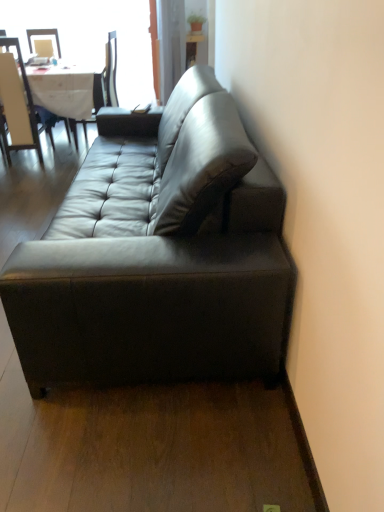
Image resolution: width=384 pixels, height=512 pixels. What do you see at coordinates (92, 37) in the screenshot?
I see `transparent glass window at upper left` at bounding box center [92, 37].

Describe the element at coordinates (102, 87) in the screenshot. I see `matte black chair at upper left, the first chair viewed from the right` at that location.

The width and height of the screenshot is (384, 512). What do you see at coordinates (68, 92) in the screenshot?
I see `white cloth table at upper left` at bounding box center [68, 92].

In order to face white cloth table at upper left, should I rotate leftwards or rightwards?

To face it directly, rotate left by 18.869 degrees.

Locate an element on the screen. transparent glass window at upper left is located at coordinates (92, 37).

You are a GUI agent. You are given a task and a screenshot of the screen. Output one action in this format:
    pyautogui.click(x=<x>, y=<y>)
    Task: Click on the 2nd chair in front of the transparent glass window at upper left, starting your count from the anchor
    The height and width of the screenshot is (512, 384).
    Given the screenshot: What is the action you would take?
    pyautogui.click(x=21, y=105)

From a real-world perspective, which is physically above, transparent glass window at upper left or light beige wood chair at upper left, the first chair viewed from the left?

From a 3D spatial view, transparent glass window at upper left is above.

Is transparent glass window at upper left far from light beige wood chair at upper left, which is the second chair from right to left?

They are positioned close to each other.

From the image's perspective, which one is positioned lower, transparent glass window at upper left or light beige wood chair at upper left, which is the second chair from right to left?

From the image's view, light beige wood chair at upper left, which is the second chair from right to left, is below.

Looking at their sizes, would you say transparent glass window at upper left is wider or thinner than matte black couch at center?

In the image, transparent glass window at upper left appears to be more narrow than matte black couch at center.

In terms of size, does transparent glass window at upper left appear bigger or smaller than matte black couch at center?

Considering their sizes, transparent glass window at upper left takes up less space than matte black couch at center.

Can you confirm if transparent glass window at upper left is shorter than matte black couch at center?

In fact, transparent glass window at upper left may be taller than matte black couch at center.

Considering the sizes of light beige wood chair at upper left, which is the second chair from right to left, and transparent glass window at upper left in the image, is light beige wood chair at upper left, which is the second chair from right to left, wider or thinner than transparent glass window at upper left?

In the image, light beige wood chair at upper left, which is the second chair from right to left, appears to be wider than transparent glass window at upper left.

Looking at this image, considering the sizes of light beige wood chair at upper left, which is the second chair from right to left, and transparent glass window at upper left in the image, is light beige wood chair at upper left, which is the second chair from right to left, taller or shorter than transparent glass window at upper left?

light beige wood chair at upper left, which is the second chair from right to left, is shorter than transparent glass window at upper left.

From a real-world perspective, is light beige wood chair at upper left, the first chair viewed from the left, over transparent glass window at upper left?

No, from a real-world perspective, light beige wood chair at upper left, the first chair viewed from the left, is not above transparent glass window at upper left.

Does light beige wood chair at upper left, the first chair viewed from the left, come behind transparent glass window at upper left?

No, it is not.

From the transparent glass window at upper left, count 1st chairs forward and point to it. Please provide its 2D coordinates.

[(102, 87)]

Which object is more forward, matte black chair at upper left, the second chair in the left-to-right sequence, or transparent glass window at upper left?

matte black chair at upper left, the second chair in the left-to-right sequence, is in front.

Between matte black chair at upper left, the first chair viewed from the right, and transparent glass window at upper left, which one has smaller width?

transparent glass window at upper left is thinner.

From a real-world perspective, is matte black couch at center located higher than transparent glass window at upper left?

Actually, matte black couch at center is physically below transparent glass window at upper left in the real world.

Who is more distant, matte black couch at center or transparent glass window at upper left?

transparent glass window at upper left.

Find the location of a particular element. studio couch directly beneath the transparent glass window at upper left (from a real-world perspective) is located at coordinates (159, 258).

From the image's perspective, is matte black chair at upper left, the first chair viewed from the right, above or below white cloth table at upper left?

From the image's perspective, matte black chair at upper left, the first chair viewed from the right, appears above white cloth table at upper left.

Is matte black chair at upper left, the second chair in the left-to-right sequence, looking in the opposite direction of white cloth table at upper left?

Correct, matte black chair at upper left, the second chair in the left-to-right sequence, is looking away from white cloth table at upper left.

Considering the relative sizes of matte black chair at upper left, the second chair in the left-to-right sequence, and white cloth table at upper left in the image provided, is matte black chair at upper left, the second chair in the left-to-right sequence, smaller than white cloth table at upper left?

Correct, matte black chair at upper left, the second chair in the left-to-right sequence, occupies less space than white cloth table at upper left.

From the image's perspective, does light beige wood chair at upper left, which is the second chair from right to left, appear lower than white cloth table at upper left?

Indeed, from the image's perspective, light beige wood chair at upper left, which is the second chair from right to left, is shown beneath white cloth table at upper left.

Is light beige wood chair at upper left, the first chair viewed from the left, closer to the viewer compared to white cloth table at upper left?

Yes, light beige wood chair at upper left, the first chair viewed from the left, is closer to the camera.

Considering the relative sizes of light beige wood chair at upper left, which is the second chair from right to left, and white cloth table at upper left in the image provided, is light beige wood chair at upper left, which is the second chair from right to left, shorter than white cloth table at upper left?

In fact, light beige wood chair at upper left, which is the second chair from right to left, may be taller than white cloth table at upper left.

Is light beige wood chair at upper left, the first chair viewed from the left, situated inside white cloth table at upper left or outside?

light beige wood chair at upper left, the first chair viewed from the left, fits inside white cloth table at upper left.

From the image's perspective, count 2nd chairs downward from the transparent glass window at upper left and point to it. Please provide its 2D coordinates.

[(21, 105)]

Find the location of a particular element. The height and width of the screenshot is (512, 384). window above the matte black couch at center (from a real-world perspective) is located at coordinates (92, 37).

From the image, which object appears to be farther from white cloth table at upper left, light beige wood chair at upper left, which is the second chair from right to left, or matte black chair at upper left, the first chair viewed from the right?

light beige wood chair at upper left, which is the second chair from right to left.

Consider the image. Estimate the real-world distances between objects in this image. Which object is closer to light beige wood chair at upper left, which is the second chair from right to left, white cloth table at upper left or matte black chair at upper left, the first chair viewed from the right?

white cloth table at upper left is positioned closer to the anchor light beige wood chair at upper left, which is the second chair from right to left.

From the picture: Considering their positions, is white cloth table at upper left positioned further to matte black couch at center than transparent glass window at upper left?

transparent glass window at upper left is further to matte black couch at center.

Which object lies nearer to the anchor point light beige wood chair at upper left, which is the second chair from right to left, transparent glass window at upper left or matte black couch at center?

transparent glass window at upper left.

Consider the image. Considering their positions, is white cloth table at upper left positioned closer to matte black chair at upper left, the first chair viewed from the right, than light beige wood chair at upper left, which is the second chair from right to left?

white cloth table at upper left lies closer to matte black chair at upper left, the first chair viewed from the right, than the other object.

Considering their positions, is matte black couch at center positioned closer to transparent glass window at upper left than matte black chair at upper left, the second chair in the left-to-right sequence?

Based on the image, matte black chair at upper left, the second chair in the left-to-right sequence, appears to be nearer to transparent glass window at upper left.

Considering their positions, is matte black couch at center positioned further to matte black chair at upper left, the first chair viewed from the right, than transparent glass window at upper left?

Among the two, matte black couch at center is located further to matte black chair at upper left, the first chair viewed from the right.

Estimate the real-world distances between objects in this image. Which object is further from white cloth table at upper left, matte black couch at center or light beige wood chair at upper left, the first chair viewed from the left?

Based on the image, matte black couch at center appears to be further to white cloth table at upper left.

This screenshot has height=512, width=384. Find the location of `chair between white cloth table at upper left and transparent glass window at upper left in the front-back direction`. chair between white cloth table at upper left and transparent glass window at upper left in the front-back direction is located at coordinates (102, 87).

Where is `table situated between light beige wood chair at upper left, the first chair viewed from the left, and matte black chair at upper left, the first chair viewed from the right, from left to right`? This screenshot has height=512, width=384. table situated between light beige wood chair at upper left, the first chair viewed from the left, and matte black chair at upper left, the first chair viewed from the right, from left to right is located at coordinates (68, 92).

The height and width of the screenshot is (512, 384). Find the location of `table between matte black couch at center and transparent glass window at upper left in the front-back direction`. table between matte black couch at center and transparent glass window at upper left in the front-back direction is located at coordinates click(68, 92).

Locate an element on the screen. The width and height of the screenshot is (384, 512). table positioned between matte black couch at center and matte black chair at upper left, the second chair in the left-to-right sequence, from near to far is located at coordinates (68, 92).